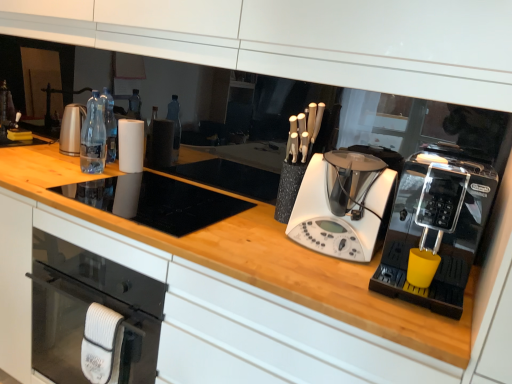
Locate an element on the screen. The width and height of the screenshot is (512, 384). vacant space in between black plastic coffee machine at right, arranged as the second home appliance when viewed from the left, and white plastic blender at center, which ranks as the 1th home appliance in left-to-right order is located at coordinates (331, 263).